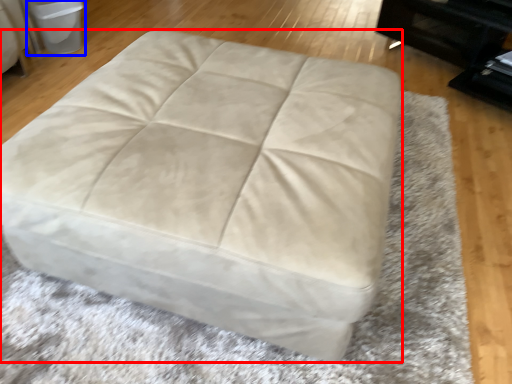
Question: Which point is closer to the camera, furniture (highlighted by a red box) or bean bag chair (highlighted by a blue box)?

Choices:
 (A) furniture
 (B) bean bag chair

Answer: (A)